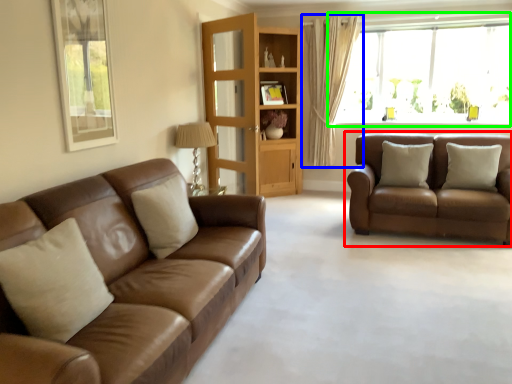
Question: Based on their relative distances, which object is farther from studio couch (highlighted by a red box)? Choose from curtain (highlighted by a blue box) and window (highlighted by a green box).

Choices:
 (A) curtain
 (B) window

Answer: (A)